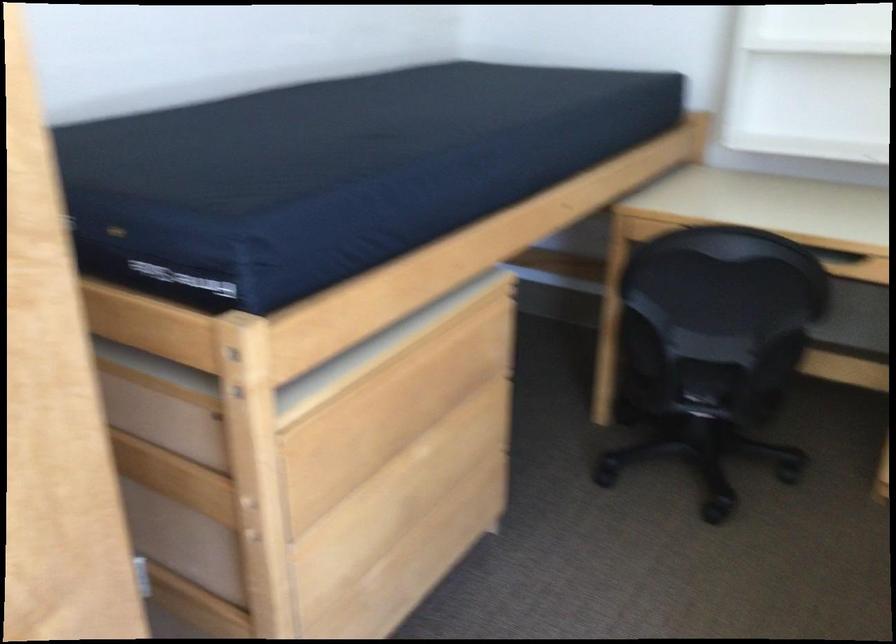
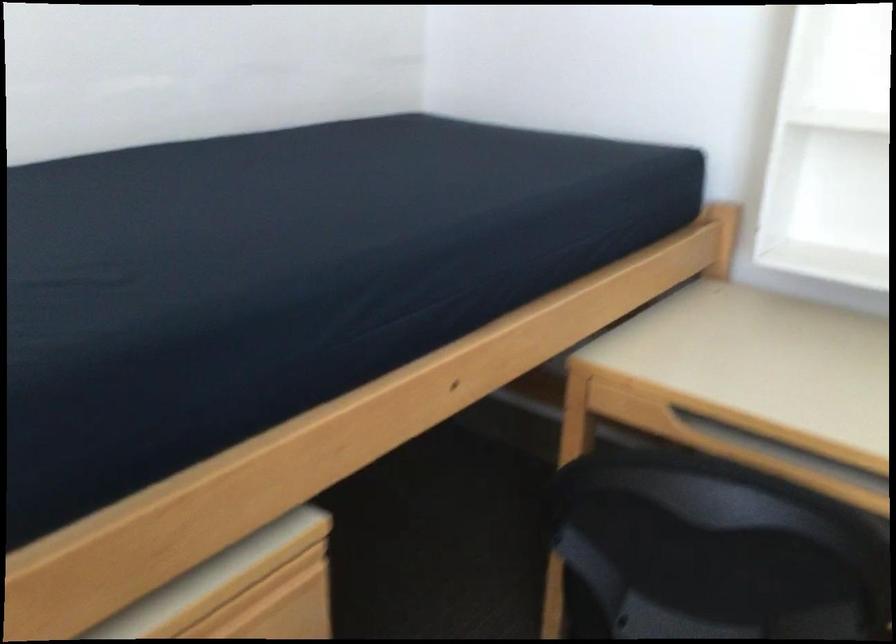
The point at [487,310] is marked in the first image. Where is the corresponding point in the second image?

(277, 581)